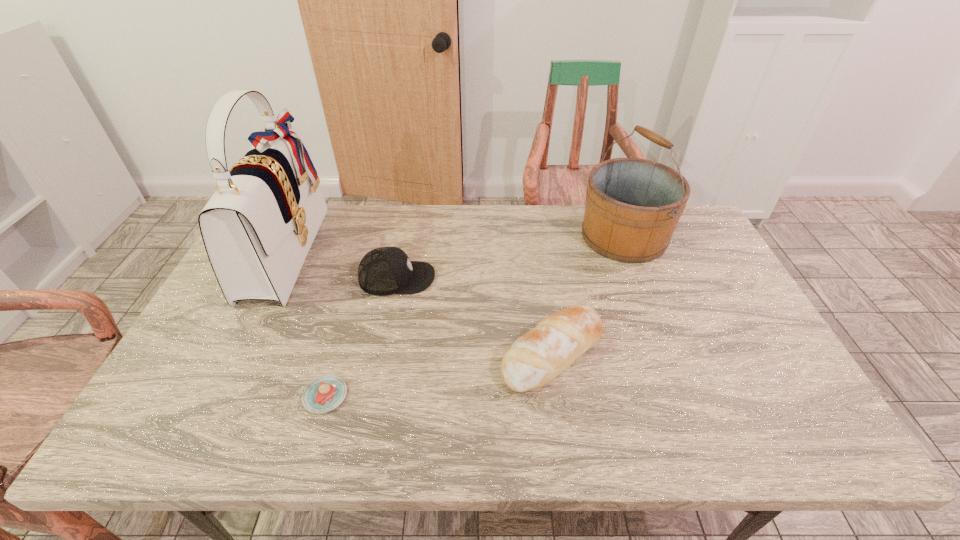
The height and width of the screenshot is (540, 960). In order to click on free point located on the back of the bread in this screenshot , I will do `click(540, 268)`.

This screenshot has height=540, width=960. In order to click on free space located on the left of the pastry in this screenshot , I will do `click(214, 396)`.

Where is `satchel at the far edge`? The height and width of the screenshot is (540, 960). satchel at the far edge is located at coordinates (257, 228).

Find the location of a particular element. The image size is (960, 540). bucket located at the far edge is located at coordinates (633, 205).

Find the location of `object that is at the near edge`. object that is at the near edge is located at coordinates (325, 393).

Locate an element on the screen. Image resolution: width=960 pixels, height=540 pixels. object that is at the left edge is located at coordinates (257, 228).

Identify the location of object present at the right edge. (633, 205).

Where is `object that is at the far left corner`? The height and width of the screenshot is (540, 960). object that is at the far left corner is located at coordinates (257, 228).

Identify the location of object that is positioned at the far right corner. (633, 205).

This screenshot has width=960, height=540. Identify the location of free region at the far edge of the desktop. (485, 235).